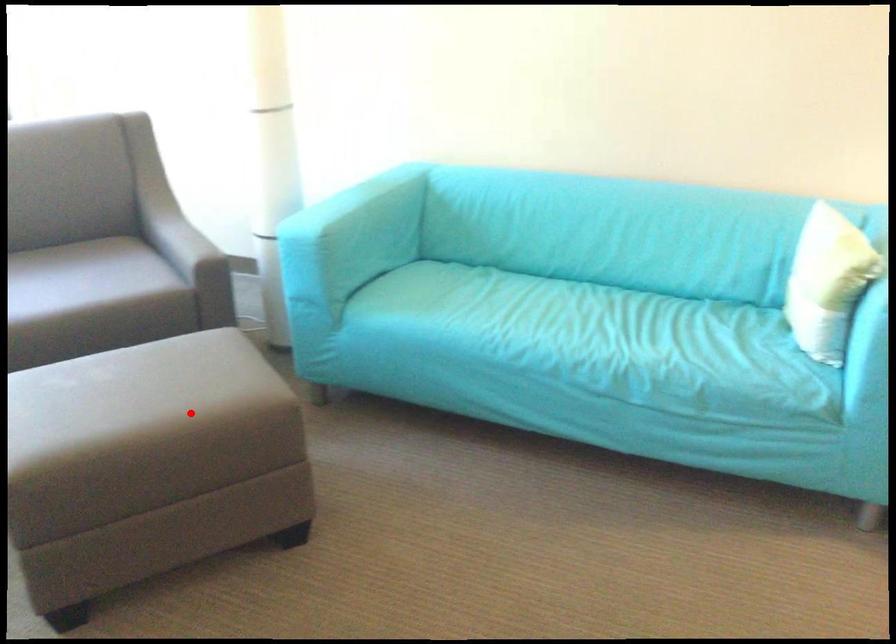
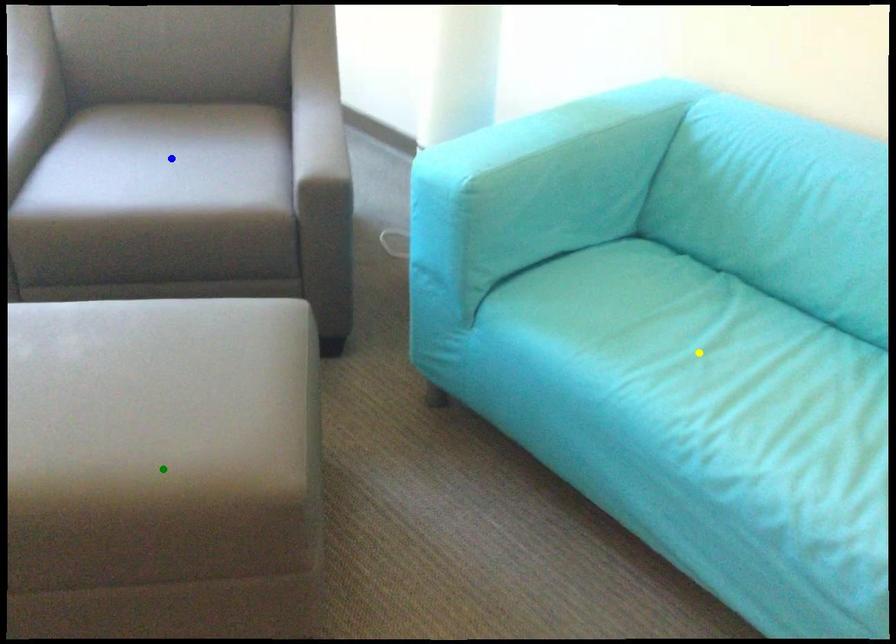
Question: I am providing you with two images of the same scene from different viewpoints. A red point is marked on the first image. You are given multiple points on the second image. Which mark in image 2 goes with the point in image 1?

Choices:
 (A) yellow point
 (B) green point
 (C) blue point

Answer: (B)